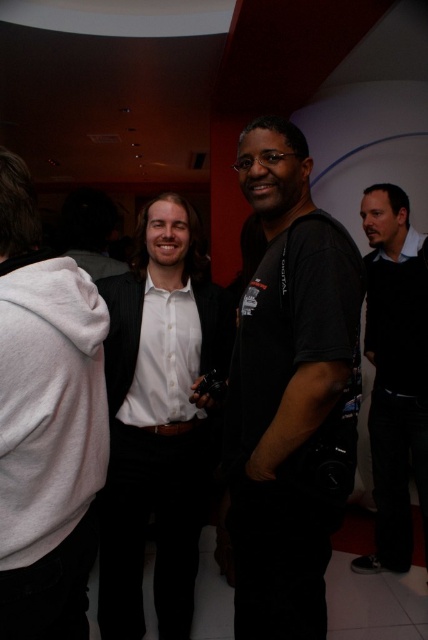
You are at a networking event and want to approach the white glossy shirt at center and the white fleece sweatshirt at left. Which one should you walk towards first if you want to greet them in the order they are positioned from closest to farthest from you?

You should first greet the white glossy shirt at center because it is closer to you than the white fleece sweatshirt at left, which is farther away.